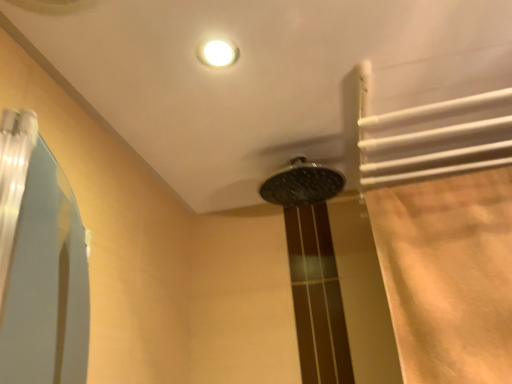
Question: Does beige fabric shower curtain at right have a smaller size compared to polished chrome showerhead at center?

Choices:
 (A) no
 (B) yes

Answer: (A)

Question: Can you confirm if beige fabric shower curtain at right is bigger than polished chrome showerhead at center?

Choices:
 (A) no
 (B) yes

Answer: (B)

Question: Is beige fabric shower curtain at right not near polished chrome showerhead at center?

Choices:
 (A) no
 (B) yes

Answer: (A)

Question: Considering the relative positions of beige fabric shower curtain at right and polished chrome showerhead at center in the image provided, is beige fabric shower curtain at right to the right of polished chrome showerhead at center from the viewer's perspective?

Choices:
 (A) no
 (B) yes

Answer: (B)

Question: Is beige fabric shower curtain at right thinner than polished chrome showerhead at center?

Choices:
 (A) no
 (B) yes

Answer: (B)

Question: From the image's perspective, is beige fabric shower curtain at right under polished chrome showerhead at center?

Choices:
 (A) yes
 (B) no

Answer: (A)

Question: Can you confirm if polished chrome showerhead at center is shorter than beige fabric shower curtain at right?

Choices:
 (A) yes
 (B) no

Answer: (A)

Question: From a real-world perspective, is polished chrome showerhead at center positioned under beige fabric shower curtain at right based on gravity?

Choices:
 (A) yes
 (B) no

Answer: (B)

Question: Is polished chrome showerhead at center positioned before beige fabric shower curtain at right?

Choices:
 (A) yes
 (B) no

Answer: (B)

Question: From a real-world perspective, is polished chrome showerhead at center located higher than beige fabric shower curtain at right?

Choices:
 (A) yes
 (B) no

Answer: (A)

Question: From the image's perspective, is polished chrome showerhead at center beneath beige fabric shower curtain at right?

Choices:
 (A) no
 (B) yes

Answer: (A)

Question: Is polished chrome showerhead at center outside beige fabric shower curtain at right?

Choices:
 (A) yes
 (B) no

Answer: (A)

Question: Would you say polished chrome showerhead at center is to the left or to the right of beige fabric shower curtain at right in the picture?

Choices:
 (A) right
 (B) left

Answer: (B)